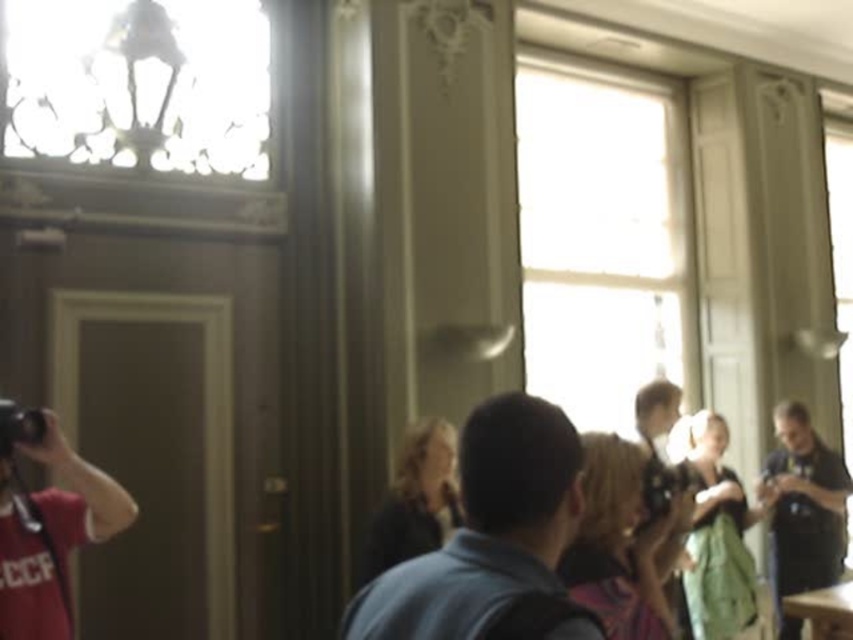
Is dark gray shirt at right below black plastic camera at left?

Yes.

Is point (792, 481) positioned behind point (0, 410)?

Yes.

What do you see at coordinates (804, 508) in the screenshot? I see `dark gray shirt at right` at bounding box center [804, 508].

Identify the location of dark gray shirt at right. (804, 508).

Is multicolored fabric bag at center below green fabric dress at center?

No.

Looking at this image, which is below, multicolored fabric bag at center or green fabric dress at center?

Positioned lower is green fabric dress at center.

Is point (631, 627) in front of point (706, 444)?

Yes, point (631, 627) is closer to viewer.

At what (x,y) coordinates should I click in order to perform the action: click on multicolored fabric bag at center. Please return your answer as a coordinate pair (x, y). The image size is (853, 640). Looking at the image, I should click on (621, 541).

Consider the image. Measure the distance between multicolored fabric bag at center and dark brown leather jacket at center.

multicolored fabric bag at center is 1.19 meters from dark brown leather jacket at center.

Who is more distant from viewer, (636,572) or (404,461)?

Positioned behind is point (404,461).

Between point (619, 442) and point (386, 500), which one is positioned behind?

The point (386, 500) is behind.

Find the location of a particular element. multicolored fabric bag at center is located at coordinates (621, 541).